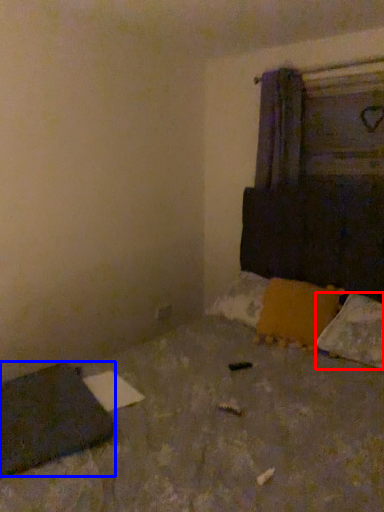
Question: Which object appears closest to the camera in this image, pillow (highlighted by a red box) or pad (highlighted by a blue box)?

Choices:
 (A) pillow
 (B) pad

Answer: (B)